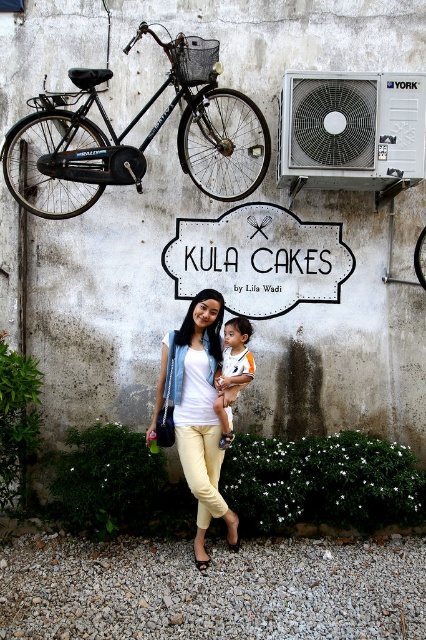
Is white paper sign at center below light yellow denim pants at center?

No, white paper sign at center is not below light yellow denim pants at center.

Based on the photo, is white paper sign at center smaller than light yellow denim pants at center?

Indeed, white paper sign at center has a smaller size compared to light yellow denim pants at center.

At what (x,y) coordinates should I click in order to perform the action: click on white paper sign at center. Please return your answer as a coordinate pair (x, y). The height and width of the screenshot is (640, 426). Looking at the image, I should click on (259, 259).

Does black matte bicycle at upper left come behind light yellow denim pants at center?

Yes.

Does point (241, 93) come closer to viewer compared to point (207, 296)?

No, (241, 93) is behind (207, 296).

Where is `black matte bicycle at upper left`? This screenshot has height=640, width=426. black matte bicycle at upper left is located at coordinates (x=143, y=140).

Who is more forward, (45, 118) or (359, 161)?

Positioned in front is point (359, 161).

Is black matte bicycle at upper left shorter than silver metallic air conditioner at upper right?

No.

Is point (226, 131) closer to camera compared to point (299, 104)?

No, it is behind (299, 104).

Find the location of `black matte bicycle at upper left`. black matte bicycle at upper left is located at coordinates (143, 140).